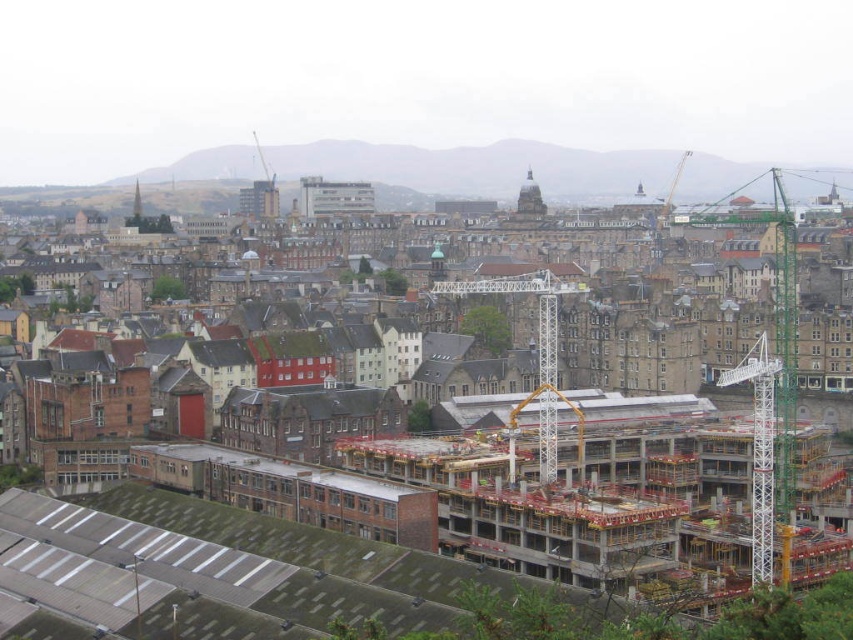
Find the location of a particular element. The width and height of the screenshot is (853, 640). white metallic crane at center is located at coordinates [x=537, y=349].

Is point (555, 449) closer to viewer compared to point (757, 497)?

No, it is not.

Between point (537, 394) and point (755, 538), which one is positioned behind?

Point (537, 394)

Identify the location of white metallic crane at center. (537, 349).

Is point (390, 476) positioned behind point (544, 426)?

Yes, point (390, 476) is behind point (544, 426).

The width and height of the screenshot is (853, 640). Describe the element at coordinates (480, 481) in the screenshot. I see `concrete construction site at center` at that location.

I want to click on concrete construction site at center, so click(480, 481).

Is concrete construction site at center shorter than white metallic crane at right?

No.

Does concrete construction site at center have a lesser width compared to white metallic crane at right?

Incorrect, concrete construction site at center's width is not less than white metallic crane at right's.

Is point (379, 508) positioned before point (776, 374)?

No, it is behind (776, 374).

This screenshot has width=853, height=640. What are the coordinates of `concrete construction site at center` in the screenshot? It's located at (480, 481).